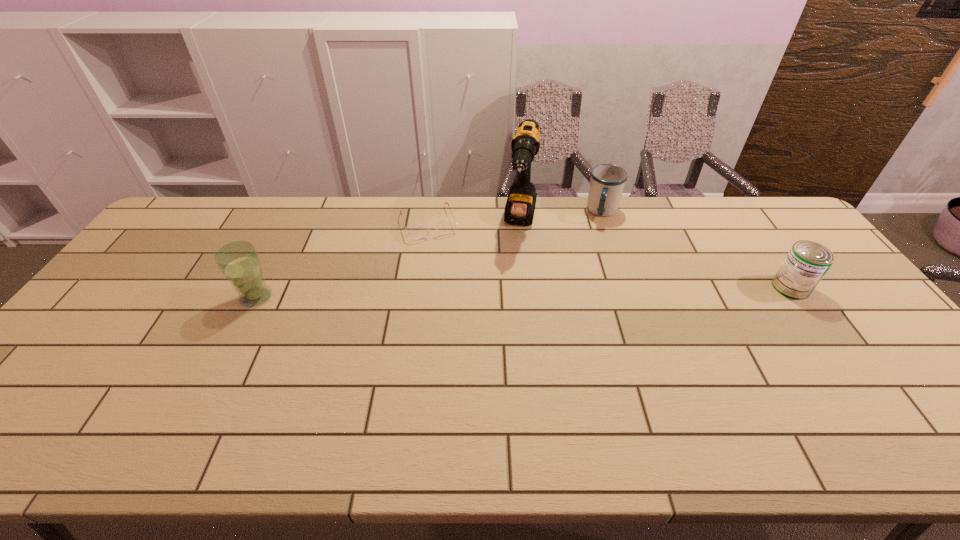
What are the coordinates of `vacant position in the image that satisfies the following two spatial constraints: 1. on the back side of the leftmost object; 2. on the right side of the can` in the screenshot? It's located at (261, 287).

You are a GUI agent. You are given a task and a screenshot of the screen. Output one action in this format:
    pyautogui.click(x=<x>, y=<y>)
    Task: Click on the vacant position in the image that satisfies the following two spatial constraints: 1. on the back side of the leftmost object; 2. on the right side of the spectacles
    The height and width of the screenshot is (540, 960).
    Given the screenshot: What is the action you would take?
    pyautogui.click(x=294, y=222)

Where is `vacant space that satisfies the following two spatial constraints: 1. on the front side of the mug; 2. on the left side of the can`? vacant space that satisfies the following two spatial constraints: 1. on the front side of the mug; 2. on the left side of the can is located at coordinates (629, 287).